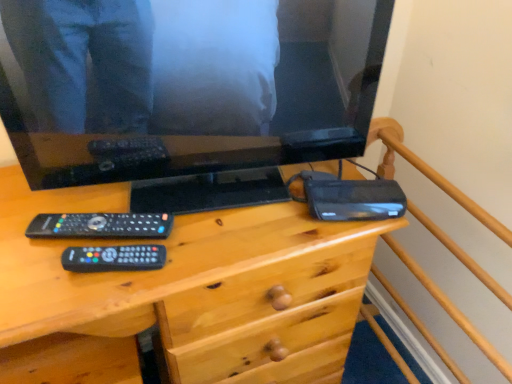
This screenshot has height=384, width=512. I want to click on vacant space that is to the left of black matte router at right, so click(x=259, y=214).